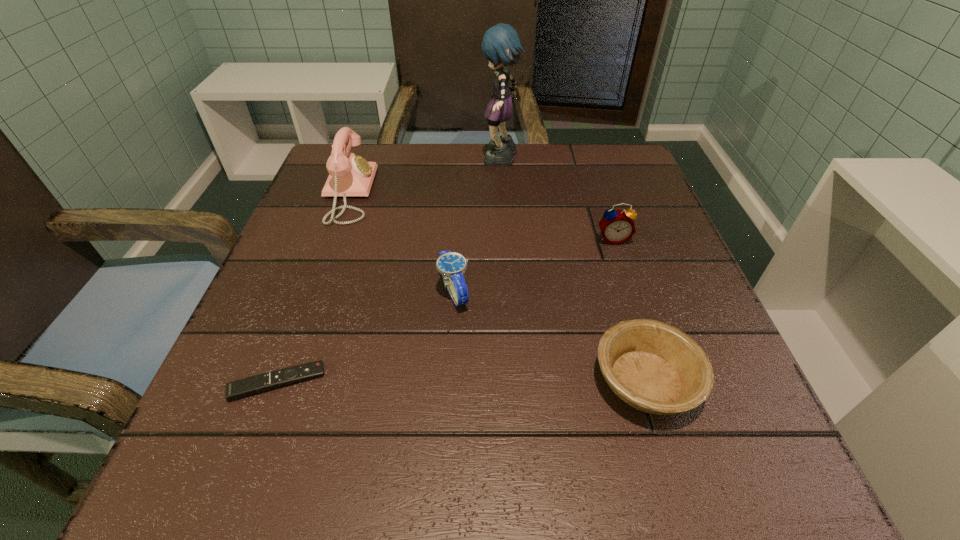
Where is `remote control at the left edge`? This screenshot has height=540, width=960. remote control at the left edge is located at coordinates (249, 386).

What are the coordinates of `alarm clock positioned at the right edge` in the screenshot? It's located at (617, 226).

Identify the location of bowl present at the right edge. This screenshot has width=960, height=540. (656, 368).

What are the coordinates of `object located at the far left corner` in the screenshot? It's located at (349, 175).

Locate an element on the screen. Image resolution: width=960 pixels, height=540 pixels. vacant area at the far edge is located at coordinates [553, 187].

Where is `free space at the near edge of the desktop`? free space at the near edge of the desktop is located at coordinates [x=480, y=434].

The image size is (960, 540). I want to click on free location at the left edge, so click(334, 284).

Identify the location of vacant space at the right edge. (660, 301).

The width and height of the screenshot is (960, 540). I want to click on vacant space at the far right corner, so click(614, 176).

You are a GUI agent. You are given a task and a screenshot of the screen. Output one action in this format:
    pyautogui.click(x=<x>, y=<y>)
    Task: Click on the free location at the near right corner of the desktop
    The image size is (960, 540).
    Given the screenshot: What is the action you would take?
    click(x=687, y=501)